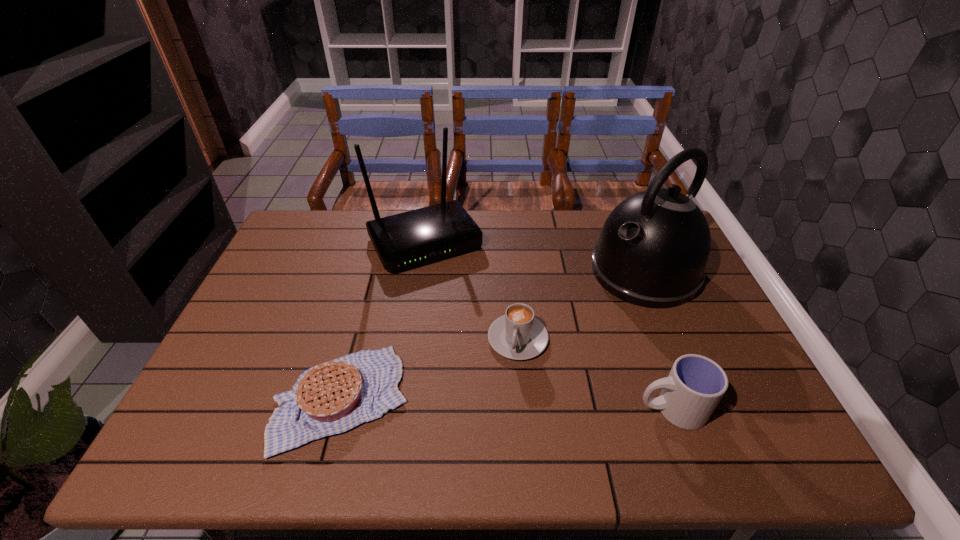
Where is `vacant space positioned to the right of the third object from left to right`? The height and width of the screenshot is (540, 960). vacant space positioned to the right of the third object from left to right is located at coordinates (500, 403).

You are a GUI agent. You are given a task and a screenshot of the screen. Output one action in this format:
    pyautogui.click(x=<x>, y=<y>)
    Task: Click on the vacant space located to the right of the third object from left to right
    The image size is (960, 540).
    Given the screenshot: What is the action you would take?
    pyautogui.click(x=501, y=399)

I want to click on vacant region located 0.150m to the right of the third object from left to right, so click(x=497, y=414).

The height and width of the screenshot is (540, 960). What are the coordinates of `vacant region located 0.360m on the front-facing side of the fourth shortest object` in the screenshot? It's located at (499, 359).

This screenshot has width=960, height=540. What are the coordinates of `blank space located 0.130m on the front-facing side of the fourth shortest object` in the screenshot? It's located at (464, 300).

Identify the location of free space located on the front-facing side of the fourth shortest object. (475, 319).

This screenshot has width=960, height=540. Find the location of `free space located 0.200m on the spout of the kettle`. free space located 0.200m on the spout of the kettle is located at coordinates (564, 328).

The width and height of the screenshot is (960, 540). I want to click on free space located on the spout of the kettle, so click(581, 316).

Where is `free space located on the spout of the kettle`? The width and height of the screenshot is (960, 540). free space located on the spout of the kettle is located at coordinates (527, 355).

Where is `router that is at the far edge`? This screenshot has width=960, height=540. router that is at the far edge is located at coordinates (411, 238).